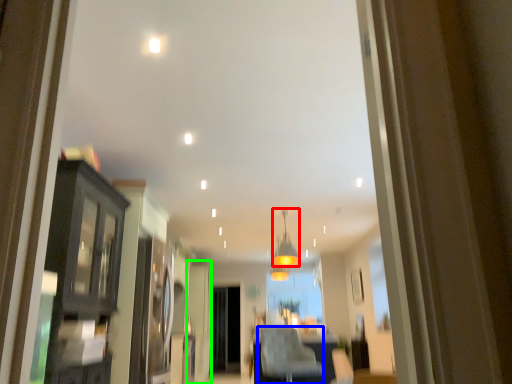
Question: Which is farther away from light fixture (highlighted by a red box)? furniture (highlighted by a blue box) or door (highlighted by a green box)?

Choices:
 (A) furniture
 (B) door

Answer: (A)